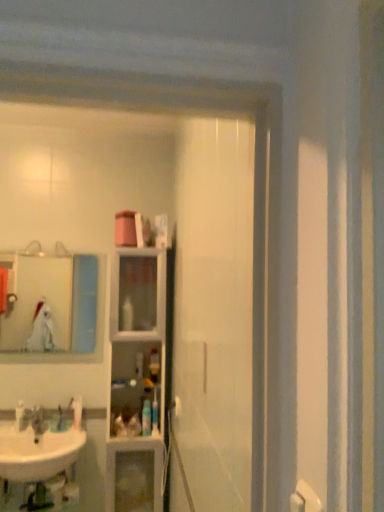
Where is `vacant space to the left of white glossy toothpaste tube at center, the second toiletry from the left`? This screenshot has height=512, width=384. vacant space to the left of white glossy toothpaste tube at center, the second toiletry from the left is located at coordinates (39, 432).